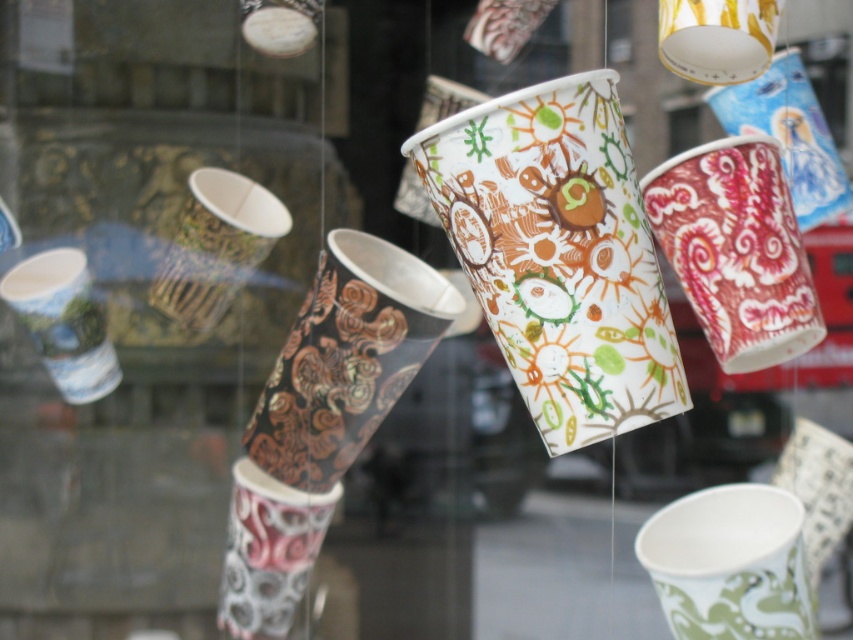
You are standing in front of a window display with multicolored paper cups suspended in midair. The cups are arranged in a specific pattern. If you were to draw a straight line from the center of the window to the multicolored paper cup at center, would the line pass through any other objects in the scene?

The multicolored paper cup at center is located at point (558, 253) in 2D coordinates, so drawing a straight line from the center of the window to this cup would not pass through any other objects since it is positioned centrally without obstruction.

You are a delivery person who needs to place a new cup that is 15 centimeters wide between the multicolored paper cup at center and the white paper cup at center. Is there enough space between them to fit the new cup?

The multicolored paper cup at center and white paper cup at center are 38.41 centimeters apart. Since the new cup is 15 centimeters wide, there is sufficient space between them to fit the new cup as 38.41 cm is greater than 15 cm.

You are a window cleaner standing in front of the window display. You need to clean the multicolored paper cup at center and the matte paper cup at left. Which cup do you need to clean first if you want to start with the one closer to you?

The multicolored paper cup at center is in front of the matte paper cup at left, so you should clean the multicolored paper cup at center first as it is closer to you.